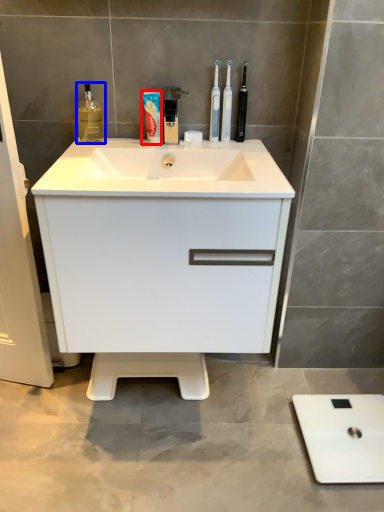
Question: Which of the following is the farthest to the observer, toothpaste (highlighted by a red box) or cleaning product (highlighted by a blue box)?

Choices:
 (A) toothpaste
 (B) cleaning product

Answer: (A)